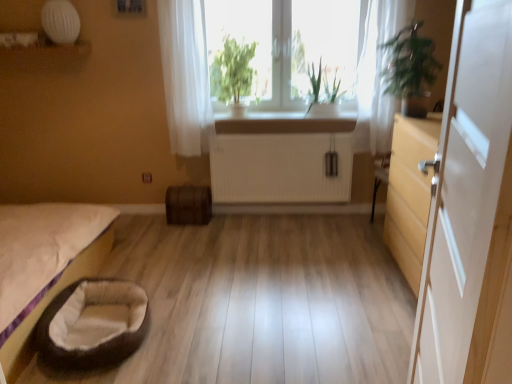
Question: Considering their positions, is white ribbed radiator at center located in front of or behind green leafy plant at center, positioned as the first plant in left-to-right order?

Choices:
 (A) behind
 (B) front

Answer: (A)

Question: Is white ribbed radiator at center bigger or smaller than green leafy plant at center, positioned as the first plant in left-to-right order?

Choices:
 (A) big
 (B) small

Answer: (B)

Question: Estimate the real-world distances between objects in this image. Which object is closer to the white ribbed radiator at center?

Choices:
 (A) green leafy plant at center, placed as the 2th plant when sorted from right to left
 (B) green leafy plant at right
 (C) white sheer curtain at upper center, the first curtain from the left
 (D) white glossy counter top at center
 (E) white plastic window frame at center

Answer: (D)

Question: Considering the real-world distances, which object is farthest from the white ribbed radiator at center?

Choices:
 (A) green leafy plant at right
 (B) brown plush infant bed at lower left
 (C) white sheer curtain at upper center, placed as the 2th curtain when sorted from right to left
 (D) green leafy plant at center, positioned as the first plant in left-to-right order
 (E) white glossy counter top at center

Answer: (B)